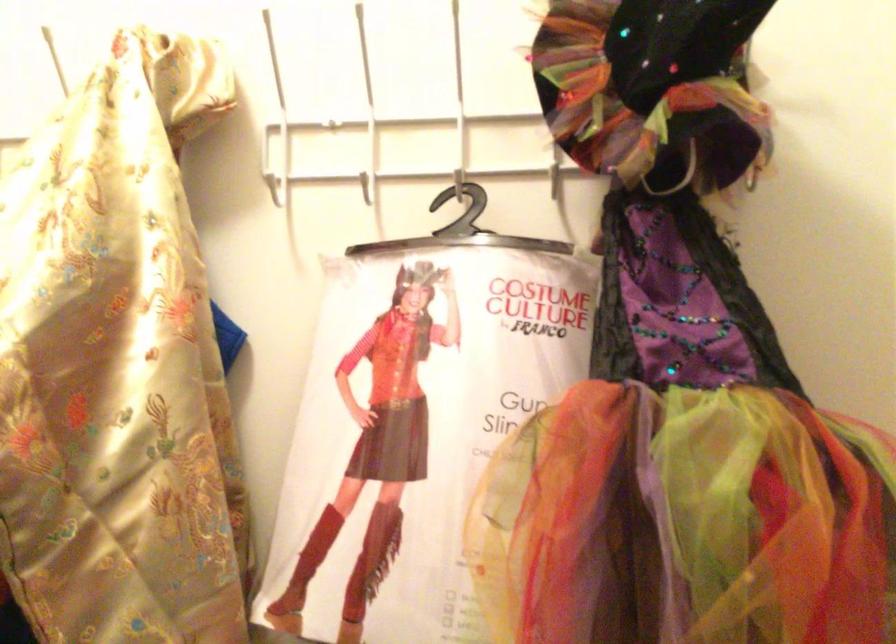
Find where to lift the black witch hat. Please return your answer as a coordinate pair (x, y).

(824, 259)